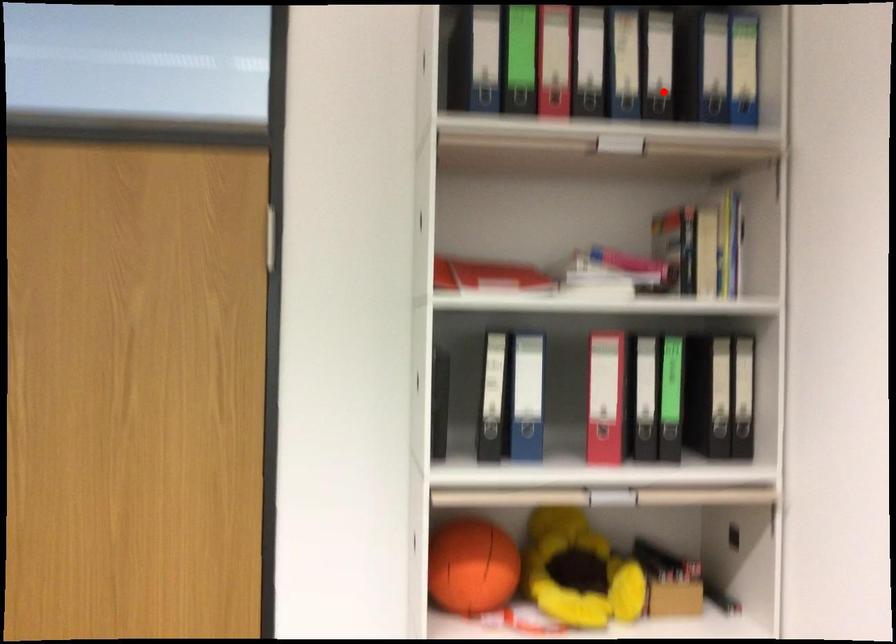
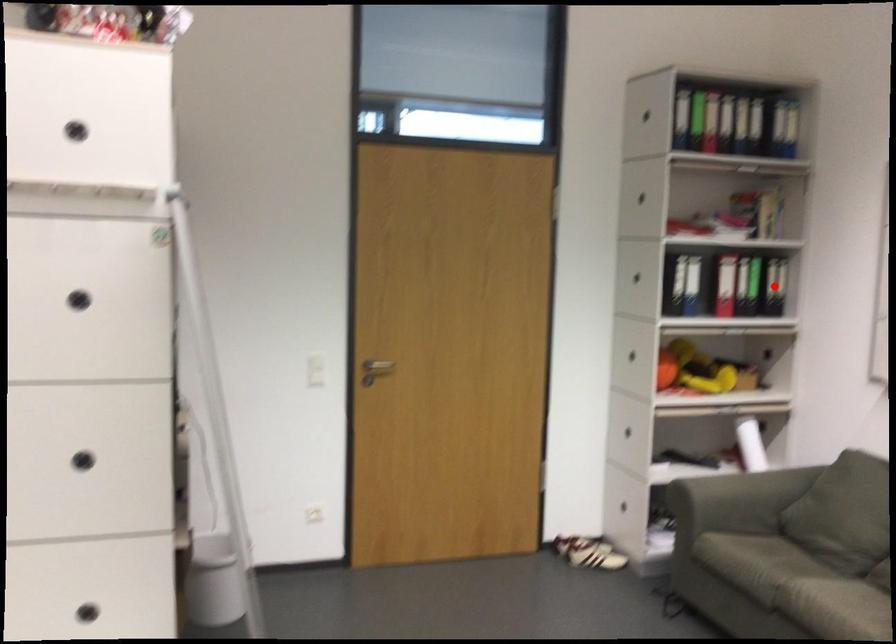
I am providing you with two images of the same scene from different viewpoints. A red point is marked on the first image and another point is marked on the second image. Do the highlighted points in image1 and image2 indicate the same real-world spot?

No